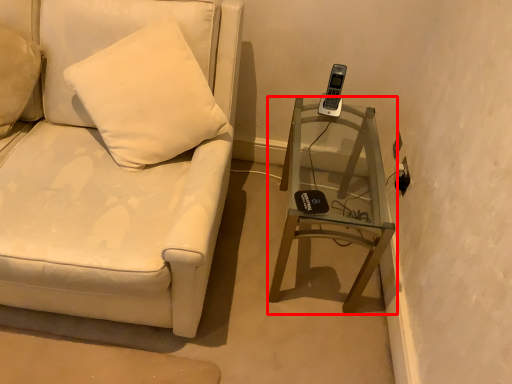
Question: From the image's perspective, what is the correct spatial relationship of table (annotated by the red box) in relation to furniture?

Choices:
 (A) below
 (B) above

Answer: (A)